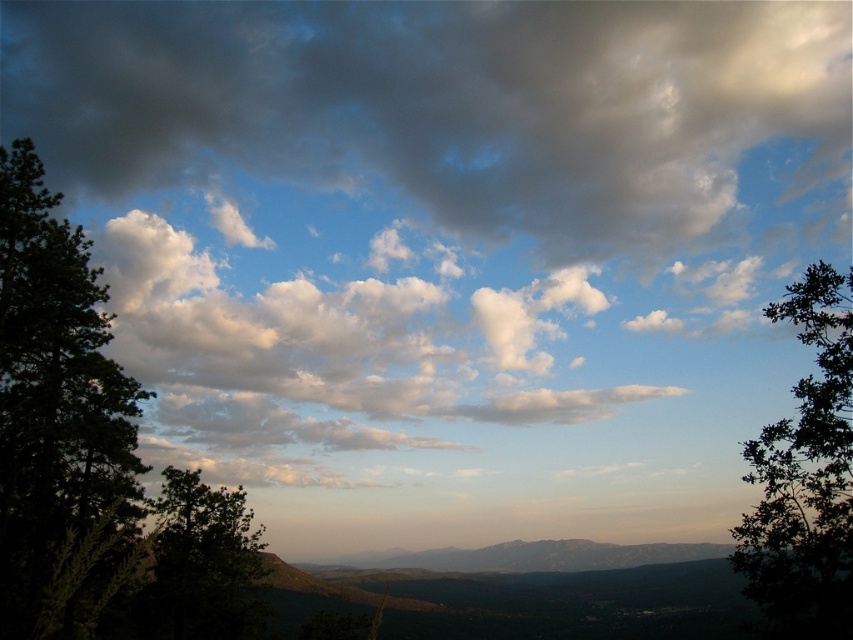
You are standing in the middle of the landscape and see the green leafy tree at right and the green matte tree at left. Which tree is closer to your right side?

The green leafy tree at right is closer to your right side because it is positioned on the right side of the green matte tree at left.